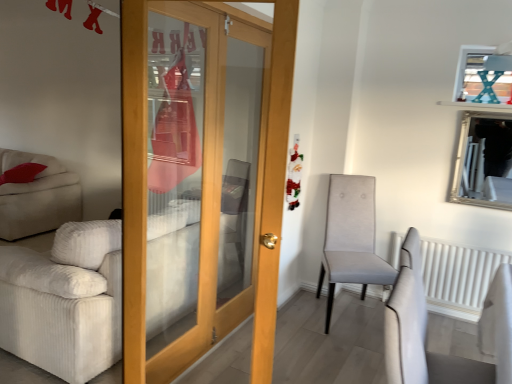
This screenshot has width=512, height=384. I want to click on empty space that is ontop of silver/glass mirror at upper right (from a real-world perspective), so click(488, 110).